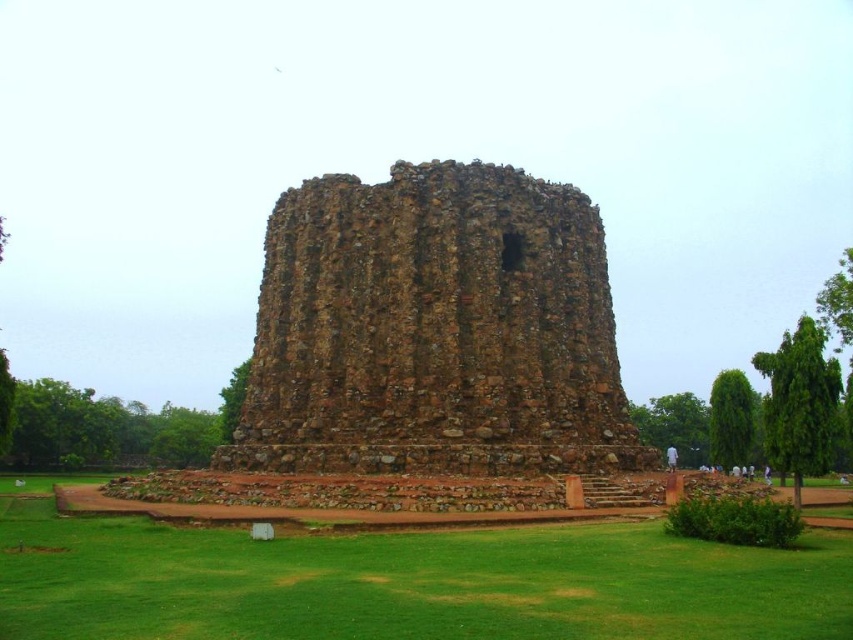
You are standing in the park and want to walk from the green grass at center to the brown stone ruins at center. Which direction should you move in relation to the structures?

You should move towards the brown stone ruins at center because it is closer to you than the green grass at center.

You are standing at the base of the brown stone ruins at center and want to reach the green grass at center. Which direction should you move to get there?

The brown stone ruins at center is located above green grass at center, so you should move downward to reach the green grass at center.

You are standing in the park and see the brown stone ruins at center and the green grass at center. Which object is positioned to the left?

The green grass at center is positioned to the left of the brown stone ruins at center.